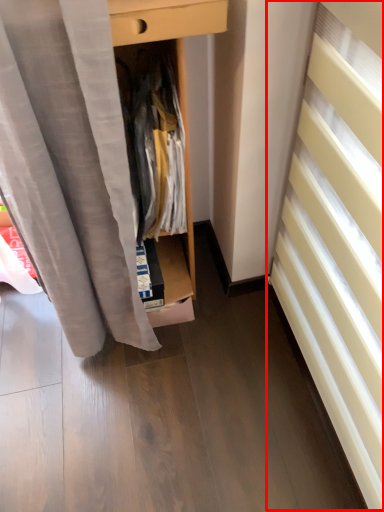
Question: From the image's perspective, considering the relative positions of stairwell (annotated by the red box) and clothing in the image provided, where is stairwell (annotated by the red box) located with respect to the staircase?

Choices:
 (A) below
 (B) above

Answer: (A)